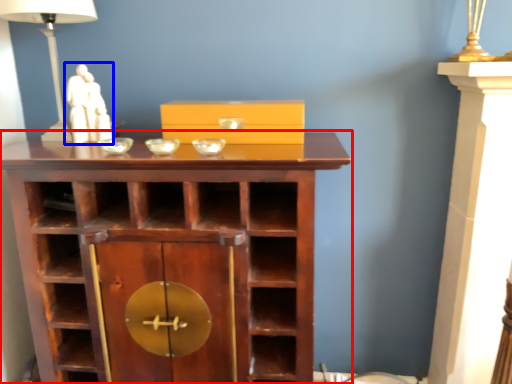
Question: Which point is closer to the camera, shelf (highlighted by a red box) or sculpture (highlighted by a blue box)?

Choices:
 (A) shelf
 (B) sculpture

Answer: (A)